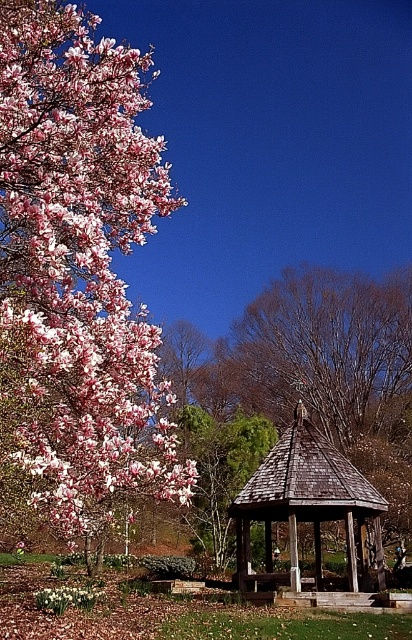
Question: Does pink matte flower at upper left appear on the right side of wooden gazebo at center?

Choices:
 (A) yes
 (B) no

Answer: (B)

Question: Which of the following is the closest to the observer?

Choices:
 (A) wooden gazebo at center
 (B) pink matte flower at upper left

Answer: (B)

Question: Which point appears closest to the camera in this image?

Choices:
 (A) (25, 8)
 (B) (274, 456)

Answer: (A)

Question: Does pink matte flower at upper left have a greater width compared to wooden gazebo at center?

Choices:
 (A) yes
 (B) no

Answer: (A)

Question: Can you confirm if pink matte flower at upper left is thinner than wooden gazebo at center?

Choices:
 (A) yes
 (B) no

Answer: (B)

Question: Which of the following is the farthest from the observer?

Choices:
 (A) pink matte flower at upper left
 (B) wooden gazebo at center

Answer: (B)